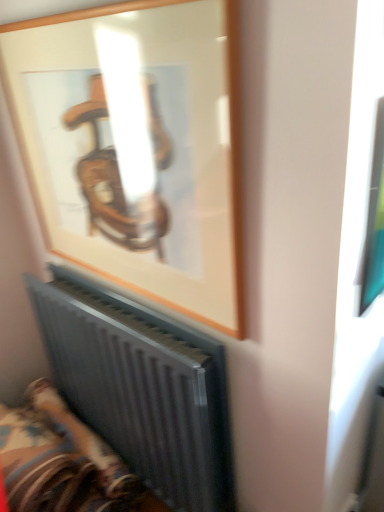
Question: From a real-world perspective, is wooden frame at upper center physically above metallic radiator at lower left?

Choices:
 (A) no
 (B) yes

Answer: (B)

Question: Is wooden frame at upper center surrounding metallic radiator at lower left?

Choices:
 (A) no
 (B) yes

Answer: (A)

Question: Considering the relative sizes of wooden frame at upper center and metallic radiator at lower left in the image provided, is wooden frame at upper center taller than metallic radiator at lower left?

Choices:
 (A) no
 (B) yes

Answer: (B)

Question: Could you tell me if wooden frame at upper center is facing metallic radiator at lower left?

Choices:
 (A) no
 (B) yes

Answer: (A)

Question: Is wooden frame at upper center not close to metallic radiator at lower left?

Choices:
 (A) yes
 (B) no

Answer: (B)

Question: Considering the positions of point (206, 116) and point (200, 458), is point (206, 116) closer or farther from the camera than point (200, 458)?

Choices:
 (A) farther
 (B) closer

Answer: (B)

Question: From a real-world perspective, is wooden frame at upper center above or below metallic gray radiator at lower left?

Choices:
 (A) above
 (B) below

Answer: (A)

Question: Relative to metallic gray radiator at lower left, is wooden frame at upper center in front or behind?

Choices:
 (A) front
 (B) behind

Answer: (A)

Question: Visually, is wooden frame at upper center positioned to the left or to the right of metallic gray radiator at lower left?

Choices:
 (A) left
 (B) right

Answer: (A)

Question: Which is correct: wooden frame at upper center is inside metallic radiator at lower left, or outside of it?

Choices:
 (A) inside
 (B) outside

Answer: (B)

Question: From their relative heights in the image, would you say wooden frame at upper center is taller or shorter than metallic radiator at lower left?

Choices:
 (A) short
 (B) tall

Answer: (B)

Question: Is wooden frame at upper center wider or thinner than metallic radiator at lower left?

Choices:
 (A) thin
 (B) wide

Answer: (A)

Question: From a real-world perspective, is wooden frame at upper center physically located above or below metallic radiator at lower left?

Choices:
 (A) below
 (B) above

Answer: (B)

Question: Would you say metallic gray radiator at lower left is to the left or to the right of wooden frame at upper center in the picture?

Choices:
 (A) left
 (B) right

Answer: (B)

Question: Considering the positions of metallic gray radiator at lower left and wooden frame at upper center in the image, is metallic gray radiator at lower left bigger or smaller than wooden frame at upper center?

Choices:
 (A) big
 (B) small

Answer: (A)